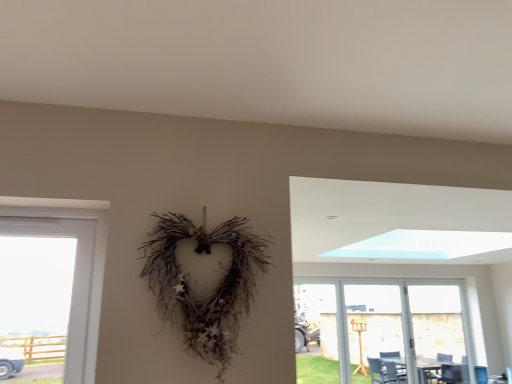
Question: Is transparent glass door at lower right positioned with its back to transparent plastic screen door at right, the first screen door in the left-to-right sequence?

Choices:
 (A) yes
 (B) no

Answer: (A)

Question: Does transparent glass door at lower right contain transparent plastic screen door at right, marked as the second screen door in a right-to-left arrangement?

Choices:
 (A) yes
 (B) no

Answer: (A)

Question: Could you tell me if transparent glass door at lower right is facing transparent plastic screen door at right, marked as the second screen door in a right-to-left arrangement?

Choices:
 (A) no
 (B) yes

Answer: (B)

Question: Does transparent glass door at lower right have a larger size compared to transparent plastic screen door at right, marked as the second screen door in a right-to-left arrangement?

Choices:
 (A) no
 (B) yes

Answer: (B)

Question: Does transparent glass door at lower right have a greater width compared to transparent plastic screen door at right, the first screen door in the left-to-right sequence?

Choices:
 (A) no
 (B) yes

Answer: (B)

Question: Does transparent glass door at lower right appear on the left side of transparent plastic screen door at right, marked as the second screen door in a right-to-left arrangement?

Choices:
 (A) no
 (B) yes

Answer: (A)

Question: Is transparent glass door at lower right not near transparent glass screen door at right, which is the 1th screen door from right to left?

Choices:
 (A) no
 (B) yes

Answer: (A)

Question: Is transparent glass door at lower right oriented towards transparent glass screen door at right, which is the 1th screen door from right to left?

Choices:
 (A) yes
 (B) no

Answer: (A)

Question: From a real-world perspective, is transparent glass door at lower right beneath transparent glass screen door at right, which is the 2th screen door in left-to-right order?

Choices:
 (A) yes
 (B) no

Answer: (A)

Question: Considering the relative sizes of transparent glass door at lower right and transparent glass screen door at right, which is the 1th screen door from right to left, in the image provided, is transparent glass door at lower right taller than transparent glass screen door at right, which is the 1th screen door from right to left,?

Choices:
 (A) no
 (B) yes

Answer: (A)

Question: Does transparent glass door at lower right contain transparent glass screen door at right, which is the 2th screen door in left-to-right order?

Choices:
 (A) yes
 (B) no

Answer: (A)

Question: From the image's perspective, is transparent glass door at lower right on top of transparent glass screen door at right, which is the 1th screen door from right to left?

Choices:
 (A) no
 (B) yes

Answer: (A)

Question: Is transparent plastic screen door at right, marked as the second screen door in a right-to-left arrangement, at the left side of transparent glass door at lower right?

Choices:
 (A) yes
 (B) no

Answer: (A)